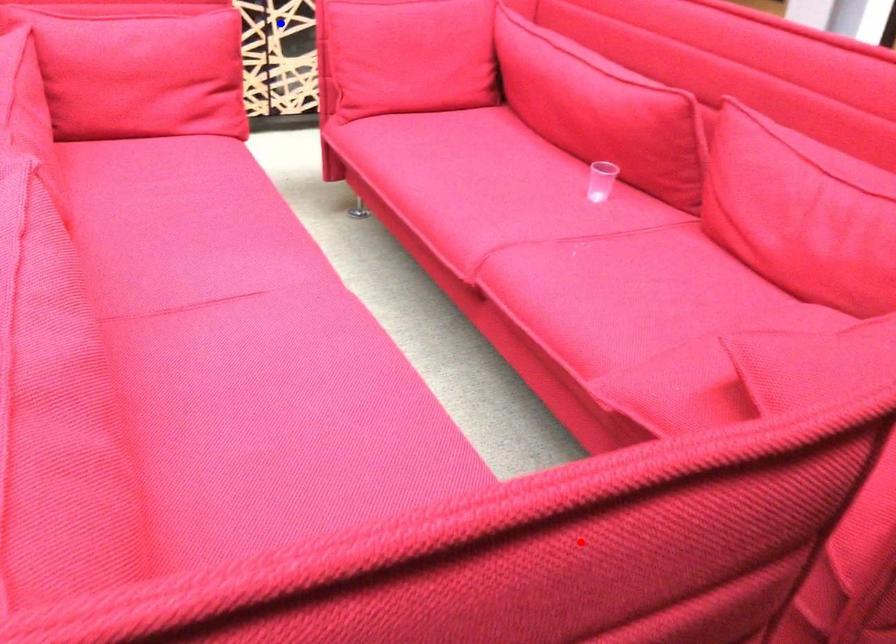
Question: Two points are marked on the image. Which point is closer to the camera?

Choices:
 (A) Blue point is closer.
 (B) Red point is closer.

Answer: (B)